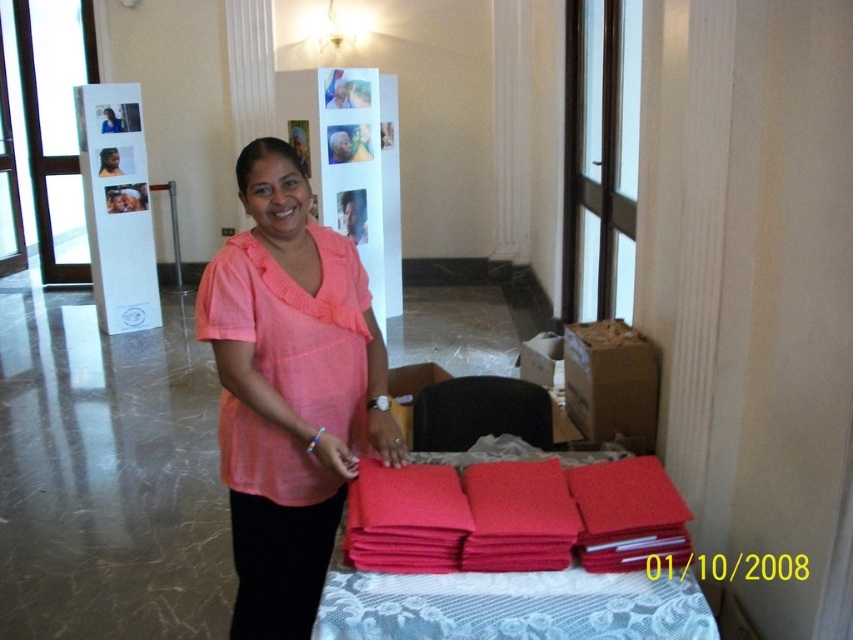
Who is more forward, (204, 333) or (699, 593)?

Positioned in front is point (699, 593).

Which of these two, pink cotton shirt at center or white lace tablecloth at center, stands shorter?

With less height is white lace tablecloth at center.

Is point (357, 444) closer to viewer compared to point (670, 616)?

No, (357, 444) is behind (670, 616).

Image resolution: width=853 pixels, height=640 pixels. Identify the location of pink cotton shirt at center. (289, 390).

Is point (405, 531) positioned in front of point (689, 589)?

No, (405, 531) is further to viewer.

Consider the image. Is matte red folder at lower center above white lace tablecloth at center?

Correct, matte red folder at lower center is located above white lace tablecloth at center.

This screenshot has height=640, width=853. In order to click on matte red folder at lower center in this screenshot , I will do `click(511, 556)`.

You are a GUI agent. You are given a task and a screenshot of the screen. Output one action in this format:
    pyautogui.click(x=<x>, y=<y>)
    Task: Click on the matte red folder at lower center
    The width and height of the screenshot is (853, 640).
    Given the screenshot: What is the action you would take?
    pyautogui.click(x=511, y=556)

Between pink cotton shirt at center and matte red folder at lower center, which one appears on the right side from the viewer's perspective?

matte red folder at lower center

Is point (325, 369) in front of point (467, 627)?

No, it is not.

Who is more distant from viewer, (x=212, y=292) or (x=425, y=468)?

The point (x=425, y=468) is behind.

The width and height of the screenshot is (853, 640). I want to click on pink cotton shirt at center, so click(289, 390).